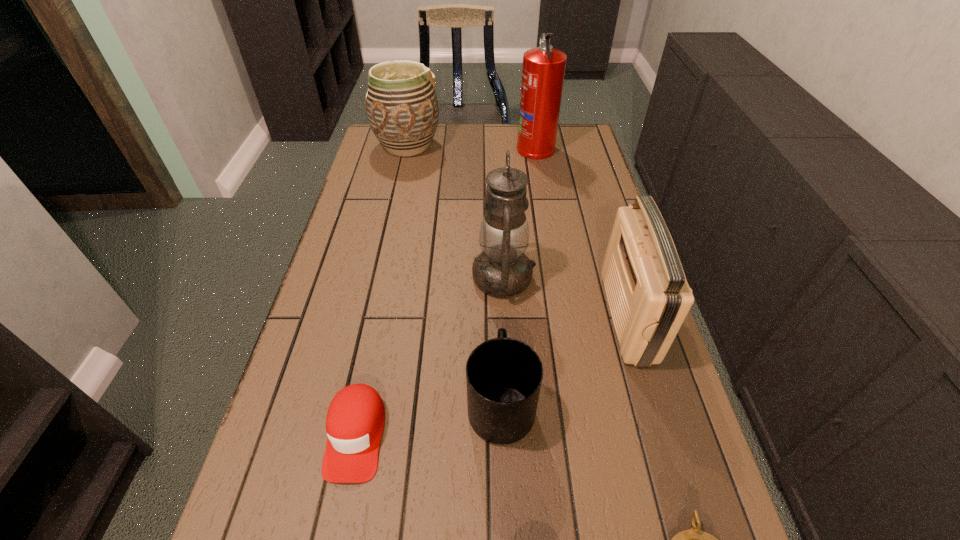
Image resolution: width=960 pixels, height=540 pixels. I want to click on fire extinguisher, so click(x=543, y=70).

Locate an element on the screen. The width and height of the screenshot is (960, 540). oil lamp is located at coordinates (502, 270).

Image resolution: width=960 pixels, height=540 pixels. Find the location of `pottery`. pottery is located at coordinates (402, 109).

The height and width of the screenshot is (540, 960). Find the location of `radio receiver`. radio receiver is located at coordinates (648, 295).

At what (x,y) coordinates should I click in order to perform the action: click on mug. Please return your answer as a coordinate pair (x, y). The image size is (960, 540). Looking at the image, I should click on (504, 375).

The height and width of the screenshot is (540, 960). I want to click on the shortest object, so click(355, 419).

This screenshot has height=540, width=960. I want to click on free space located 0.300m on the instruction side of the fire extinguisher, so click(x=433, y=148).

Where is `vacant space situated on the instruction side of the fire extinguisher`? This screenshot has width=960, height=540. vacant space situated on the instruction side of the fire extinguisher is located at coordinates (449, 148).

This screenshot has height=540, width=960. Identify the location of vacant space located on the instruction side of the fire extinguisher. (449, 148).

Where is `vacant space situated on the back of the oil lamp`? vacant space situated on the back of the oil lamp is located at coordinates (498, 180).